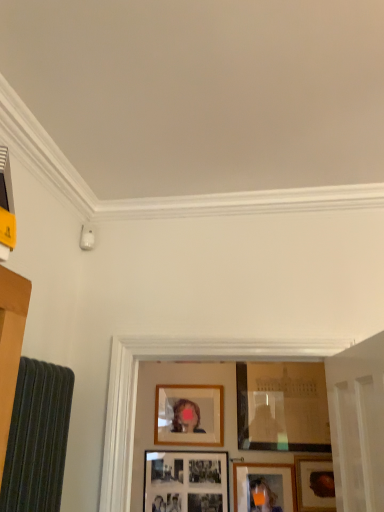
Question: Considering the relative sizes of matte glass picture frame at center, the second picture frame viewed from the right, and matte wooden picture frame at lower center, which is the 3th picture frame in left-to-right order, in the image provided, is matte glass picture frame at center, the second picture frame viewed from the right, bigger than matte wooden picture frame at lower center, which is the 3th picture frame in left-to-right order,?

Choices:
 (A) no
 (B) yes

Answer: (B)

Question: From the image's perspective, is matte glass picture frame at center, the second picture frame viewed from the right, on matte wooden picture frame at lower center, which is the 3th picture frame in left-to-right order?

Choices:
 (A) yes
 (B) no

Answer: (A)

Question: Is matte glass picture frame at center, acting as the 4th picture frame starting from the left, facing away from matte wooden picture frame at lower center, the third picture frame when ordered from right to left?

Choices:
 (A) yes
 (B) no

Answer: (B)

Question: Considering the relative positions of matte glass picture frame at center, the second picture frame viewed from the right, and matte wooden picture frame at lower center, which is the 3th picture frame in left-to-right order, in the image provided, is matte glass picture frame at center, the second picture frame viewed from the right, to the right of matte wooden picture frame at lower center, which is the 3th picture frame in left-to-right order, from the viewer's perspective?

Choices:
 (A) yes
 (B) no

Answer: (A)

Question: Is matte glass picture frame at center, the second picture frame viewed from the right, not inside matte wooden picture frame at lower center, which is the 3th picture frame in left-to-right order?

Choices:
 (A) no
 (B) yes

Answer: (B)

Question: Looking at their shapes, would you say wooden picture frame at center, positioned as the second picture frame in left-to-right order, is wider or thinner than matte black picture frame at lower center, the fifth picture frame from the right?

Choices:
 (A) thin
 (B) wide

Answer: (B)

Question: From a real-world perspective, is wooden picture frame at center, positioned as the second picture frame in left-to-right order, positioned above or below matte black picture frame at lower center, which is the 1th picture frame in left-to-right order?

Choices:
 (A) below
 (B) above

Answer: (B)

Question: From their relative heights in the image, would you say wooden picture frame at center, the fourth picture frame positioned from the right, is taller or shorter than matte black picture frame at lower center, the fifth picture frame from the right?

Choices:
 (A) tall
 (B) short

Answer: (A)

Question: From the image's perspective, is wooden picture frame at center, the fourth picture frame positioned from the right, above or below matte black picture frame at lower center, which is the 1th picture frame in left-to-right order?

Choices:
 (A) below
 (B) above

Answer: (B)

Question: Is matte wooden picture frame at lower center, which is the 3th picture frame in left-to-right order, in front of or behind wooden picture frame at center, the fourth picture frame positioned from the right, in the image?

Choices:
 (A) behind
 (B) front

Answer: (B)

Question: Based on their sizes in the image, would you say matte wooden picture frame at lower center, the third picture frame when ordered from right to left, is bigger or smaller than wooden picture frame at center, positioned as the second picture frame in left-to-right order?

Choices:
 (A) small
 (B) big

Answer: (A)

Question: Based on their positions, is matte wooden picture frame at lower center, the third picture frame when ordered from right to left, located to the left or right of wooden picture frame at center, the fourth picture frame positioned from the right?

Choices:
 (A) left
 (B) right

Answer: (B)

Question: Considering the positions of point (281, 507) and point (172, 434), is point (281, 507) closer or farther from the camera than point (172, 434)?

Choices:
 (A) farther
 (B) closer

Answer: (B)

Question: In terms of height, does matte wooden picture frame at lower center, the third picture frame when ordered from right to left, look taller or shorter compared to wooden frame at lower right, acting as the first picture frame starting from the right?

Choices:
 (A) short
 (B) tall

Answer: (A)

Question: In the image, is matte wooden picture frame at lower center, which is the 3th picture frame in left-to-right order, on the left side or the right side of wooden frame at lower right, acting as the first picture frame starting from the right?

Choices:
 (A) left
 (B) right

Answer: (A)